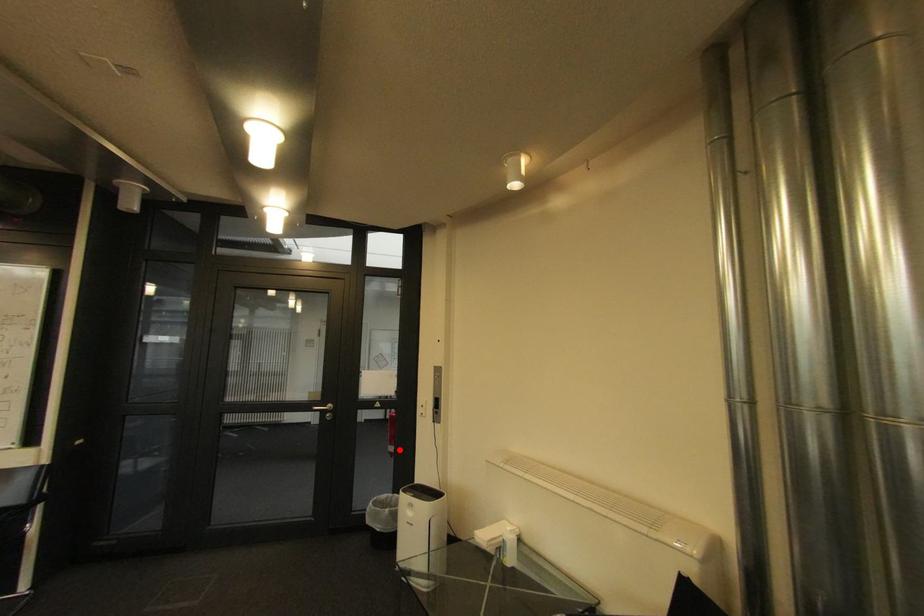
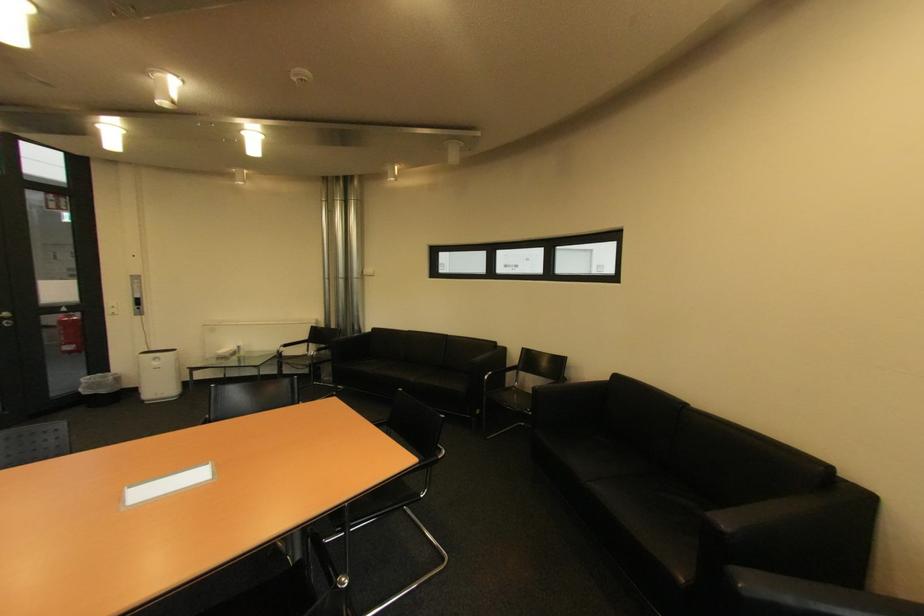
The point at the highlighted location is marked in the first image. Where is the corresponding point in the second image?

(79, 349)